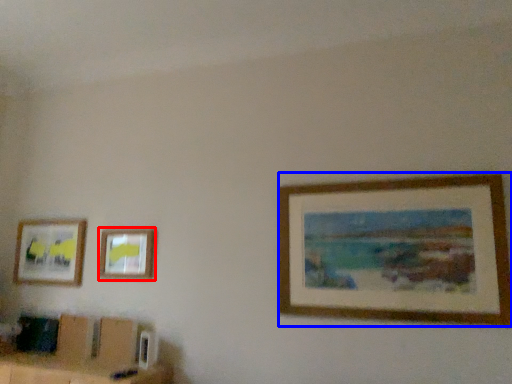
Question: Which object appears closest to the camera in this image, picture frame (highlighted by a red box) or picture frame (highlighted by a blue box)?

Choices:
 (A) picture frame
 (B) picture frame

Answer: (B)